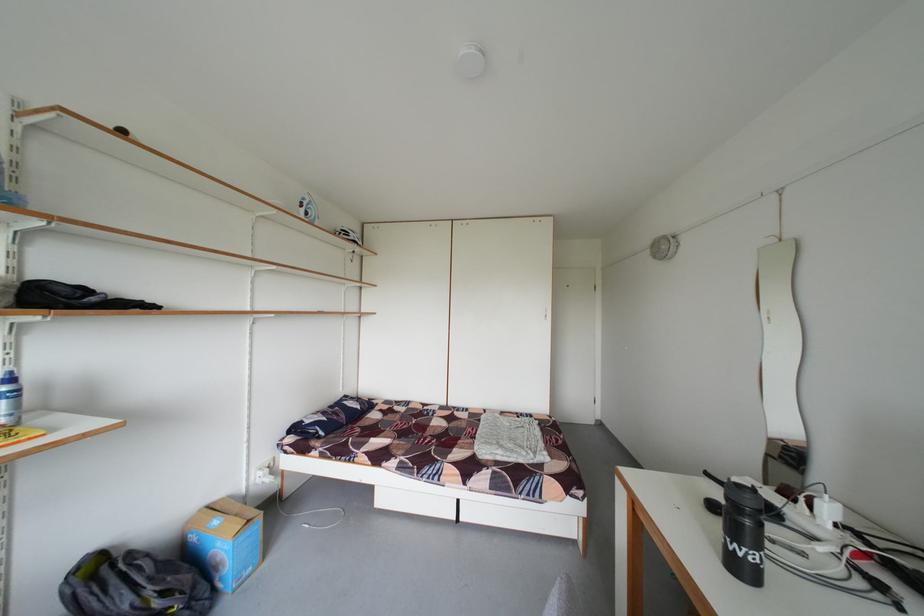
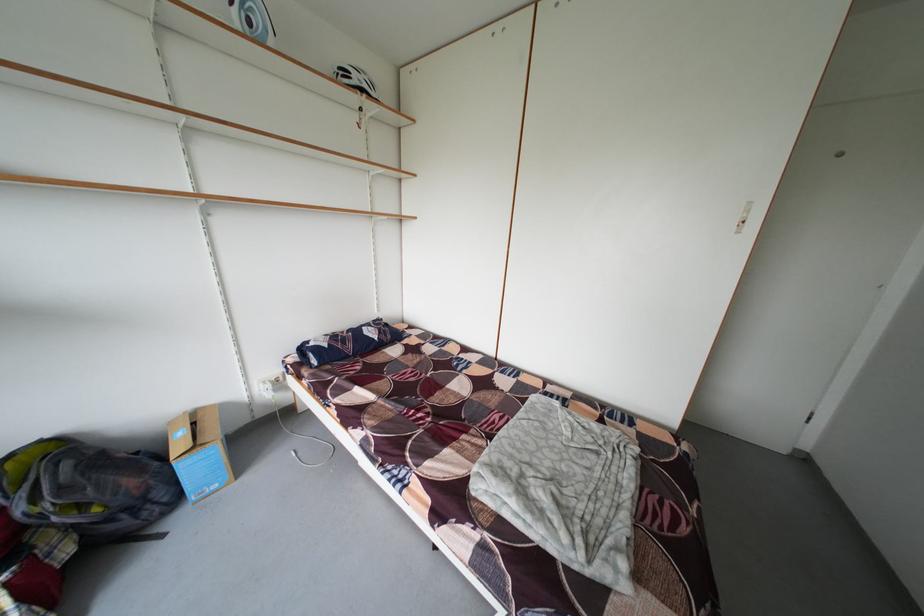
Locate, in the second image, the point that corresponds to point 480,435 in the first image.

(506, 422)